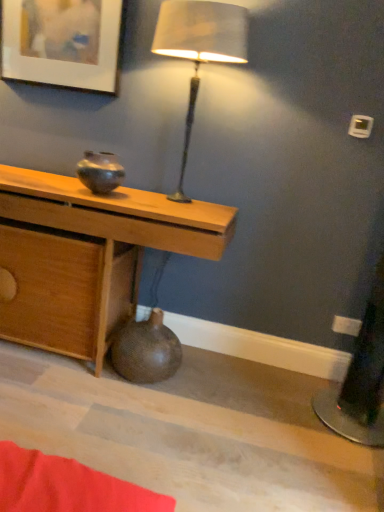
Locate an element on the screen. This screenshot has width=384, height=512. free space in front of brown textured vase at lower center, which is counted as the second vase, starting from the top is located at coordinates (136, 411).